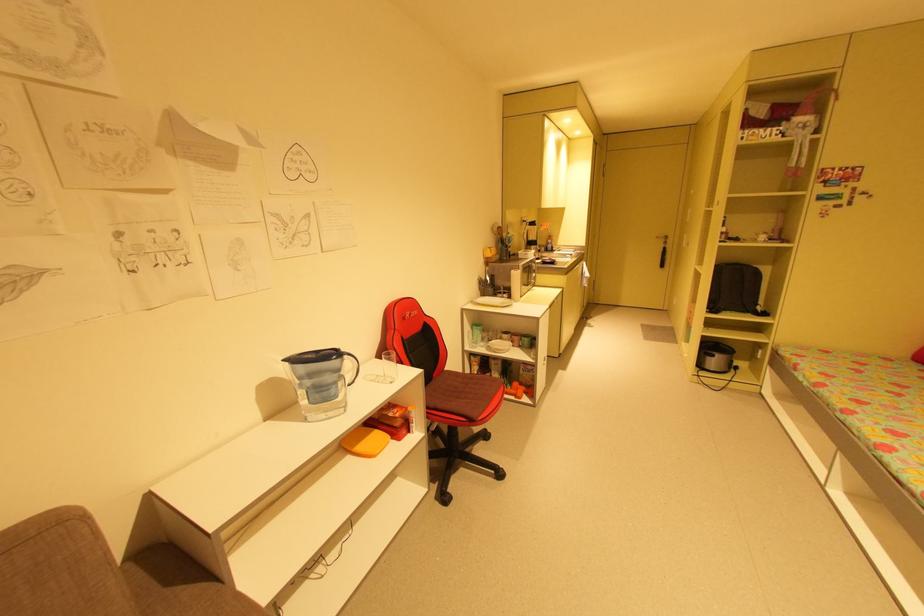
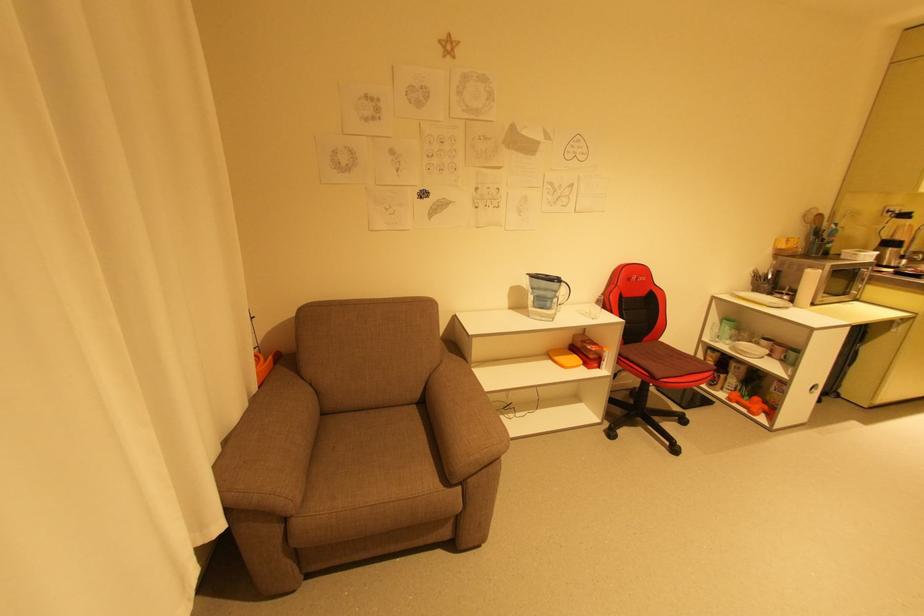
Question: The camera is either moving clockwise (left) or counter-clockwise (right) around the object. The first image is from the beginning of the video and the second image is from the end. Is the camera moving left or right when shooting the video?

Choices:
 (A) Left
 (B) Right

Answer: (B)